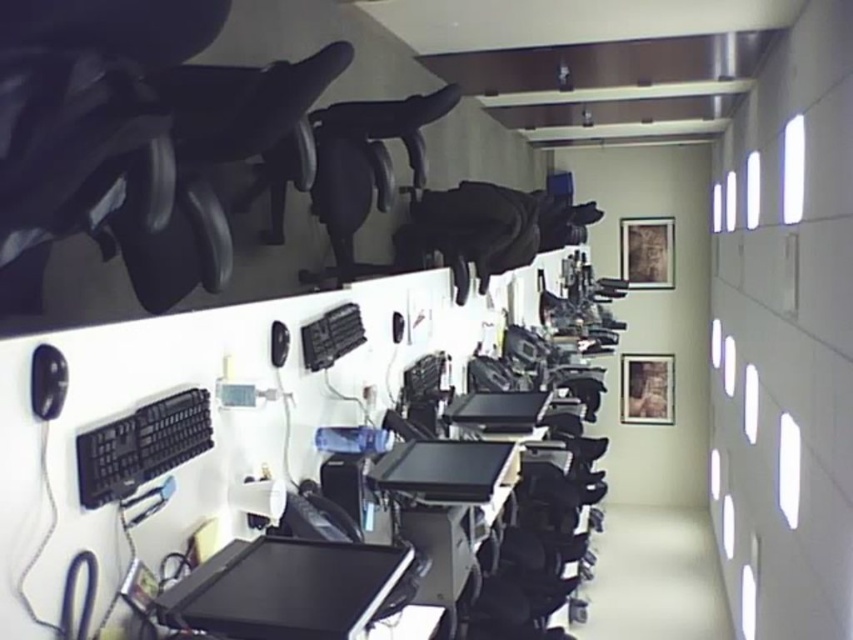
You are an office worker who needs to adjust your computer monitor. You see the black matte monitor at center and the black plastic keyboard at lower left. Which object is positioned lower in the workspace?

The black matte monitor at center is located below the black plastic keyboard at lower left, so the monitor is positioned lower in the workspace.

You are standing in the office and want to move from point A to point B. Point A is at coordinates point (202, 620) and point B is at coordinates point (108, 444). Which point is closer to you?

Point (108, 444) is closer to you because it is nearer to the camera than point (202, 620).

You are an office worker who needs to adjust the height of your workstation. You have a monitor and keyboard that are at different heights. Which object, the black matte monitor at center or the black plastic keyboard at lower left, is shorter and needs to be raised to match the other?

The black matte monitor at center is not as tall as the black plastic keyboard at lower left, so the monitor needs to be raised to match the keyboard.